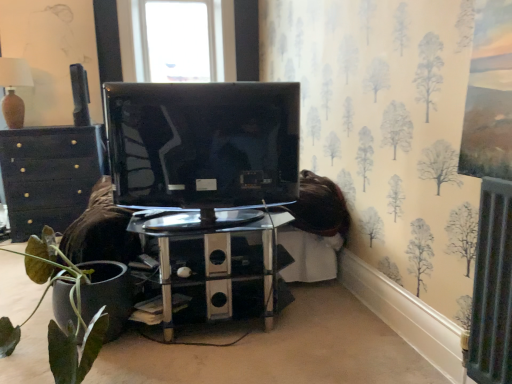
Question: From the image's perspective, would you say polished chrome table at center is positioned over metallic gray speaker at upper left?

Choices:
 (A) no
 (B) yes

Answer: (A)

Question: Is the position of polished chrome table at center more distant than that of metallic gray speaker at upper left?

Choices:
 (A) no
 (B) yes

Answer: (A)

Question: Is polished chrome table at center surrounding metallic gray speaker at upper left?

Choices:
 (A) no
 (B) yes

Answer: (A)

Question: Can you confirm if polished chrome table at center is positioned to the left of metallic gray speaker at upper left?

Choices:
 (A) no
 (B) yes

Answer: (A)

Question: Are polished chrome table at center and metallic gray speaker at upper left beside each other?

Choices:
 (A) no
 (B) yes

Answer: (A)

Question: Is polished chrome table at center shorter than metallic gray speaker at upper left?

Choices:
 (A) no
 (B) yes

Answer: (A)

Question: Is matte black chest of drawers at left not near polished chrome table at center?

Choices:
 (A) yes
 (B) no

Answer: (A)

Question: From the image's perspective, is matte black chest of drawers at left on top of polished chrome table at center?

Choices:
 (A) no
 (B) yes

Answer: (B)

Question: From a real-world perspective, is matte black chest of drawers at left positioned over polished chrome table at center based on gravity?

Choices:
 (A) no
 (B) yes

Answer: (B)

Question: Does matte black chest of drawers at left lie in front of polished chrome table at center?

Choices:
 (A) yes
 (B) no

Answer: (B)

Question: From the image's perspective, does matte black chest of drawers at left appear lower than polished chrome table at center?

Choices:
 (A) yes
 (B) no

Answer: (B)

Question: Can you confirm if matte black chest of drawers at left is positioned to the left of polished chrome table at center?

Choices:
 (A) no
 (B) yes

Answer: (B)

Question: Can you confirm if glossy black tv at center is taller than matte black chest of drawers at left?

Choices:
 (A) yes
 (B) no

Answer: (B)